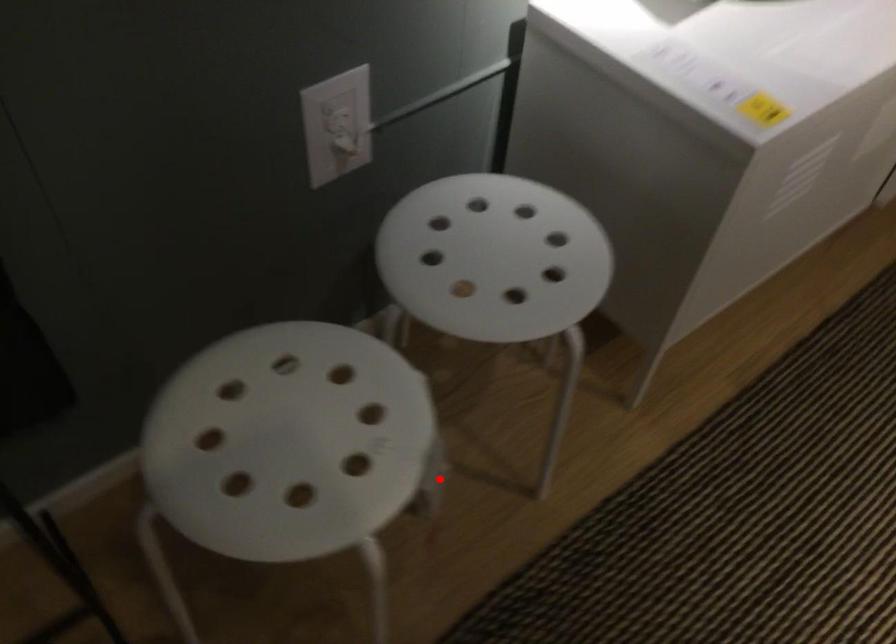
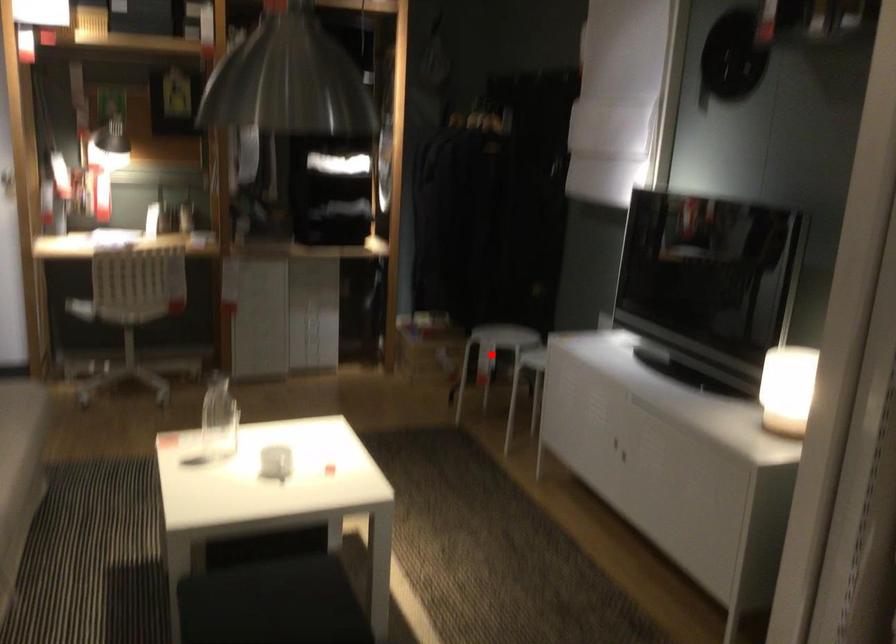
I am providing you with two images of the same scene from different viewpoints. A red point is marked on the first image and another point is marked on the second image. Is the red point in image1 aligned with the point shown in image2?

Yes